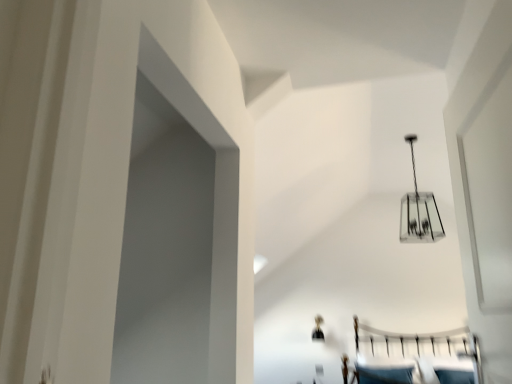
Image resolution: width=512 pixels, height=384 pixels. What do you see at coordinates (419, 211) in the screenshot?
I see `clear glass chandelier at upper center, the second lamp in the bottom-to-top sequence` at bounding box center [419, 211].

Locate an element on the screen. The height and width of the screenshot is (384, 512). clear glass chandelier at upper center, marked as the first lamp in a right-to-left arrangement is located at coordinates (419, 211).

Measure the distance between point (415,188) and camera.

The distance of point (415,188) from camera is 16.04 feet.

Image resolution: width=512 pixels, height=384 pixels. Describe the element at coordinates (318, 329) in the screenshot. I see `clear glass chandelier at upper center, which ranks as the second lamp in top-to-bottom order` at that location.

Identify the location of clear glass chandelier at upper center, the 2th lamp when ordered from front to back. (318, 329).

The width and height of the screenshot is (512, 384). Find the location of `clear glass chandelier at upper center, which is the 2th lamp in back-to-front order`. clear glass chandelier at upper center, which is the 2th lamp in back-to-front order is located at coordinates (419, 211).

Does clear glass chandelier at upper center, the first lamp from the bottom, appear on the right side of clear glass chandelier at upper center, which appears as the second lamp when viewed from the left?

In fact, clear glass chandelier at upper center, the first lamp from the bottom, is to the left of clear glass chandelier at upper center, which appears as the second lamp when viewed from the left.

Is the depth of clear glass chandelier at upper center, which ranks as the second lamp in top-to-bottom order, greater than that of clear glass chandelier at upper center, which appears as the second lamp when viewed from the left?

Yes, clear glass chandelier at upper center, which ranks as the second lamp in top-to-bottom order, is further from the viewer.

Considering the points (319, 324) and (402, 214), which point is behind, point (319, 324) or point (402, 214)?

The point (402, 214) is more distant.

From the image's perspective, is clear glass chandelier at upper center, the first lamp from the bottom, above or below clear glass chandelier at upper center, which appears as the second lamp when viewed from the left?

From the image's perspective, clear glass chandelier at upper center, the first lamp from the bottom, appears below clear glass chandelier at upper center, which appears as the second lamp when viewed from the left.

From a real-world perspective, is clear glass chandelier at upper center, which appears as the first lamp when viewed from the left, beneath clear glass chandelier at upper center, which is the 2th lamp in back-to-front order?

Yes, from a real-world perspective, clear glass chandelier at upper center, which appears as the first lamp when viewed from the left, is below clear glass chandelier at upper center, which is the 2th lamp in back-to-front order.

Which of these two, clear glass chandelier at upper center, the 2th lamp when ordered from front to back, or clear glass chandelier at upper center, which appears as the second lamp when viewed from the left, is thinner?

clear glass chandelier at upper center, the 2th lamp when ordered from front to back.

Can you confirm if clear glass chandelier at upper center, the first lamp from the bottom, is shorter than clear glass chandelier at upper center, which is the 2th lamp in back-to-front order?

Yes, clear glass chandelier at upper center, the first lamp from the bottom, is shorter than clear glass chandelier at upper center, which is the 2th lamp in back-to-front order.

Considering the sizes of objects clear glass chandelier at upper center, which appears as the first lamp when viewed from the left, and clear glass chandelier at upper center, which appears as the second lamp when viewed from the left, in the image provided, who is bigger, clear glass chandelier at upper center, which appears as the first lamp when viewed from the left, or clear glass chandelier at upper center, which appears as the second lamp when viewed from the left,?

clear glass chandelier at upper center, which appears as the second lamp when viewed from the left, is bigger.

Is clear glass chandelier at upper center, which is the 2th lamp in right-to-left order, outside of clear glass chandelier at upper center, which appears as the second lamp when viewed from the left?

Yes, clear glass chandelier at upper center, which is the 2th lamp in right-to-left order, is not within clear glass chandelier at upper center, which appears as the second lamp when viewed from the left.

Are clear glass chandelier at upper center, which ranks as the second lamp in top-to-bottom order, and clear glass chandelier at upper center, marked as the first lamp in a right-to-left arrangement, making contact?

clear glass chandelier at upper center, which ranks as the second lamp in top-to-bottom order, and clear glass chandelier at upper center, marked as the first lamp in a right-to-left arrangement, are clearly separated.

Is clear glass chandelier at upper center, the first lamp from the bottom, turned away from clear glass chandelier at upper center, arranged as the 1th lamp when viewed from the front?

No, clear glass chandelier at upper center, arranged as the 1th lamp when viewed from the front, is not at the back of clear glass chandelier at upper center, the first lamp from the bottom.

How different are the orientations of clear glass chandelier at upper center, which appears as the 1th lamp when viewed from the back, and clear glass chandelier at upper center, placed as the first lamp when sorted from top to bottom, in degrees?

clear glass chandelier at upper center, which appears as the 1th lamp when viewed from the back, and clear glass chandelier at upper center, placed as the first lamp when sorted from top to bottom, are facing 0.517 degrees away from each other.

How much distance is there between clear glass chandelier at upper center, the first lamp from the bottom, and clear glass chandelier at upper center, which appears as the second lamp when viewed from the left?

The distance of clear glass chandelier at upper center, the first lamp from the bottom, from clear glass chandelier at upper center, which appears as the second lamp when viewed from the left, is 5.58 feet.

The height and width of the screenshot is (384, 512). In the image, there is a clear glass chandelier at upper center, the second lamp in the bottom-to-top sequence. In order to click on lamp below it (from the image's perspective) in this screenshot , I will do `click(318, 329)`.

Considering the positions of objects clear glass chandelier at upper center, placed as the first lamp when sorted from top to bottom, and clear glass chandelier at upper center, which appears as the 1th lamp when viewed from the back, in the image provided, who is more to the right, clear glass chandelier at upper center, placed as the first lamp when sorted from top to bottom, or clear glass chandelier at upper center, which appears as the 1th lamp when viewed from the back,?

From the viewer's perspective, clear glass chandelier at upper center, placed as the first lamp when sorted from top to bottom, appears more on the right side.

Which object is more forward, clear glass chandelier at upper center, marked as the first lamp in a right-to-left arrangement, or clear glass chandelier at upper center, which appears as the 1th lamp when viewed from the back?

clear glass chandelier at upper center, marked as the first lamp in a right-to-left arrangement.

Is point (434, 228) farther from camera compared to point (316, 330)?

Yes.

From the image's perspective, which is below, clear glass chandelier at upper center, the second lamp in the bottom-to-top sequence, or clear glass chandelier at upper center, which is the 2th lamp in right-to-left order?

From the image's view, clear glass chandelier at upper center, which is the 2th lamp in right-to-left order, is below.

From a real-world perspective, is clear glass chandelier at upper center, marked as the first lamp in a right-to-left arrangement, physically above clear glass chandelier at upper center, which appears as the first lamp when viewed from the left?

Yes.

Does clear glass chandelier at upper center, the second lamp in the bottom-to-top sequence, have a greater width compared to clear glass chandelier at upper center, the first lamp from the bottom?

Indeed, clear glass chandelier at upper center, the second lamp in the bottom-to-top sequence, has a greater width compared to clear glass chandelier at upper center, the first lamp from the bottom.

Considering the relative sizes of clear glass chandelier at upper center, the second lamp in the bottom-to-top sequence, and clear glass chandelier at upper center, which ranks as the second lamp in top-to-bottom order, in the image provided, is clear glass chandelier at upper center, the second lamp in the bottom-to-top sequence, shorter than clear glass chandelier at upper center, which ranks as the second lamp in top-to-bottom order,?

No, clear glass chandelier at upper center, the second lamp in the bottom-to-top sequence, is not shorter than clear glass chandelier at upper center, which ranks as the second lamp in top-to-bottom order.

Based on the photo, can you confirm if clear glass chandelier at upper center, marked as the first lamp in a right-to-left arrangement, is bigger than clear glass chandelier at upper center, the first lamp from the bottom?

Indeed, clear glass chandelier at upper center, marked as the first lamp in a right-to-left arrangement, has a larger size compared to clear glass chandelier at upper center, the first lamp from the bottom.

Is clear glass chandelier at upper center, placed as the first lamp when sorted from top to bottom, not within clear glass chandelier at upper center, the first lamp from the bottom?

That's correct, clear glass chandelier at upper center, placed as the first lamp when sorted from top to bottom, is outside of clear glass chandelier at upper center, the first lamp from the bottom.

Is clear glass chandelier at upper center, marked as the first lamp in a right-to-left arrangement, not close to clear glass chandelier at upper center, which appears as the 1th lamp when viewed from the back?

Yes, clear glass chandelier at upper center, marked as the first lamp in a right-to-left arrangement, and clear glass chandelier at upper center, which appears as the 1th lamp when viewed from the back, are located far from each other.

Is clear glass chandelier at upper center, which appears as the second lamp when viewed from the left, facing away from clear glass chandelier at upper center, which ranks as the second lamp in top-to-bottom order?

No.

How many degrees apart are the facing directions of clear glass chandelier at upper center, placed as the first lamp when sorted from top to bottom, and clear glass chandelier at upper center, which is the 2th lamp in right-to-left order?

clear glass chandelier at upper center, placed as the first lamp when sorted from top to bottom, and clear glass chandelier at upper center, which is the 2th lamp in right-to-left order, are facing 0.517 degrees away from each other.

Find the location of a particular element. lamp above the clear glass chandelier at upper center, which ranks as the second lamp in top-to-bottom order (from the image's perspective) is located at coordinates (419, 211).

You are a GUI agent. You are given a task and a screenshot of the screen. Output one action in this format:
    pyautogui.click(x=<x>, y=<y>)
    Task: Click on the lamp below the clear glass chandelier at upper center, which appears as the second lamp when viewed from the left (from a real-world perspective)
    The image size is (512, 384).
    Given the screenshot: What is the action you would take?
    pyautogui.click(x=318, y=329)

At what (x,y) coordinates should I click in order to perform the action: click on lamp below the clear glass chandelier at upper center, marked as the first lamp in a right-to-left arrangement (from the image's perspective). Please return your answer as a coordinate pair (x, y). Looking at the image, I should click on (318, 329).